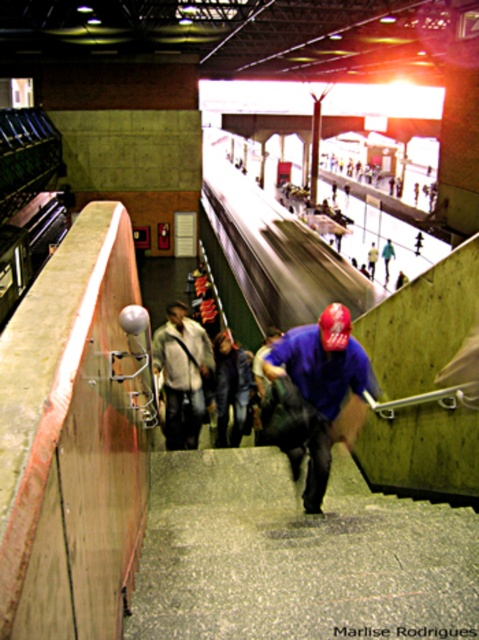
How much distance is there between blue matte shirt at center and light brown leather jacket at center?

blue matte shirt at center and light brown leather jacket at center are 9.02 feet apart.

Which is above, blue matte shirt at center or light brown leather jacket at center?

Positioned higher is light brown leather jacket at center.

Between point (304, 448) and point (197, 356), which one is positioned behind?

The point (197, 356) is more distant.

What are the coordinates of `blue matte shirt at center` in the screenshot? It's located at (316, 396).

From the picture: Is blue matte shirt at center shorter than dark blue shirt at center?

Incorrect, blue matte shirt at center's height does not fall short of dark blue shirt at center's.

Is point (265, 435) positioned behind point (218, 396)?

No, (265, 435) is closer to viewer.

Is point (323, 413) farther from viewer compared to point (226, 333)?

No, (323, 413) is closer to viewer.

Where is `blue matte shirt at center`? This screenshot has width=479, height=640. blue matte shirt at center is located at coordinates tap(316, 396).

Looking at this image, who is shorter, light brown leather jacket at center or dark blue shirt at center?

Standing shorter between the two is dark blue shirt at center.

Is point (203, 346) positioned before point (225, 435)?

No, it is behind (225, 435).

Find the location of `light brown leather jacket at center`. light brown leather jacket at center is located at coordinates (182, 374).